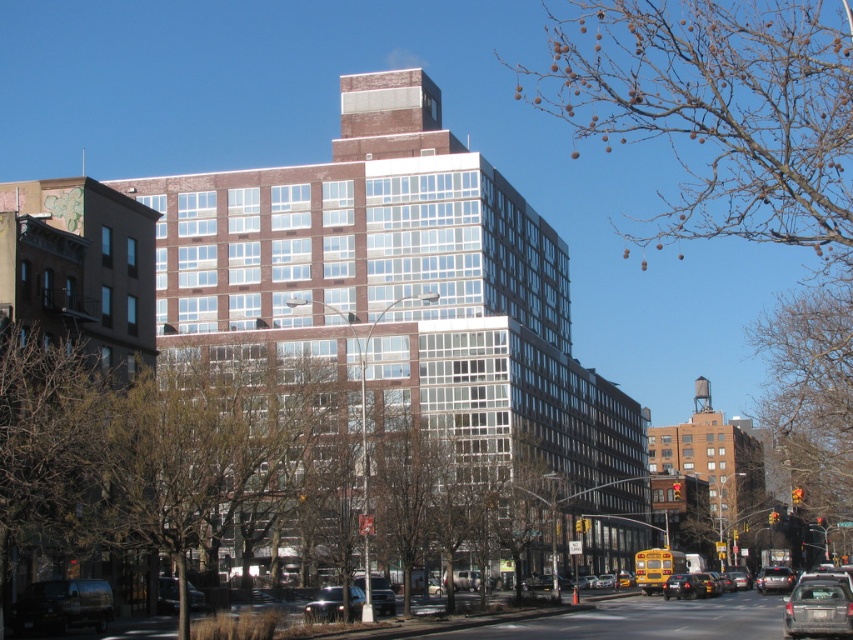
You are standing at a point in the urban street scene. The point you are currently at is labeled as point (160, 602). If you want to walk towards the building with the reddish brown brick facade and white framed windows, will you be moving closer to or farther away from your current position?

The point (160, 602) is 88.67 meters away from the viewer. If you walk towards the building with the reddish brown brick facade and white framed windows, you will be moving closer to the building and thus closer to the point (160, 602).

You are a delivery person trying to decide which vehicle to park closer to the building entrance. The entrance is at the base of the building with a height restriction of 2 meters. Which vehicle, the dark gray matte van at lower left or the yellow matte taxi at center, is more suitable for parking under this restriction?

The dark gray matte van at lower left has a lesser height compared to the yellow matte taxi at center. Since the entrance has a 2 meters height restriction, the dark gray matte van at lower left is more suitable because its lower height ensures it complies with the height limit.